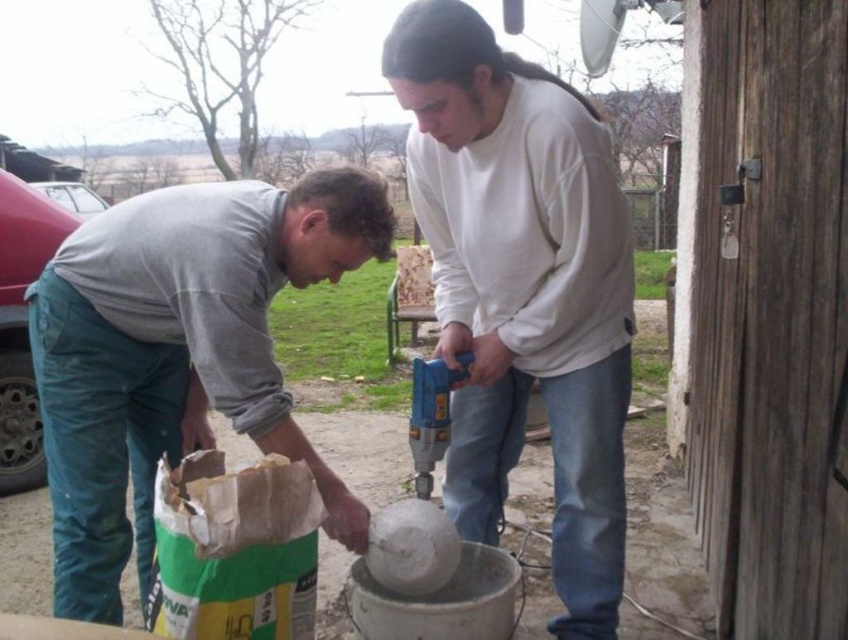
You are standing at the origin of the coordinate system in the image. There is a gray fabric shirt at lower left marked by point (179, 355). If you move 0.1 units to the right along the x axis, will you be closer to or farther from the gray fabric shirt at lower left?

Moving 0.1 units to the right along the x axis from the origin would take you to the point 0.655, 0.212. The gray fabric shirt at lower left is located at (179, 355). Since 0.655 is greater than 0.555 on the x axis, you would be farther from the gray fabric shirt at lower left.

You are a contractor working on a construction site. You need to use the drill that is positioned higher up. Which drill should you choose between the white matte drill at center and the blue plastic drill at center?

The white matte drill at center is above the blue plastic drill at center, so you should choose the white matte drill at center.

You are a contractor assessing the safety of this construction site. You notice the gray fabric shirt at lower left and the blue plastic drill at center. Which object is positioned higher in the image?

The gray fabric shirt at lower left is taller than the blue plastic drill at center, so the gray fabric shirt at lower left is positioned higher in the image.